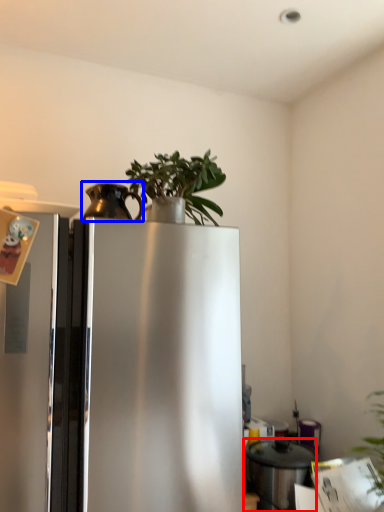
Question: Which object is closer to the camera taking this photo, appliance (highlighted by a red box) or appliance (highlighted by a blue box)?

Choices:
 (A) appliance
 (B) appliance

Answer: (B)